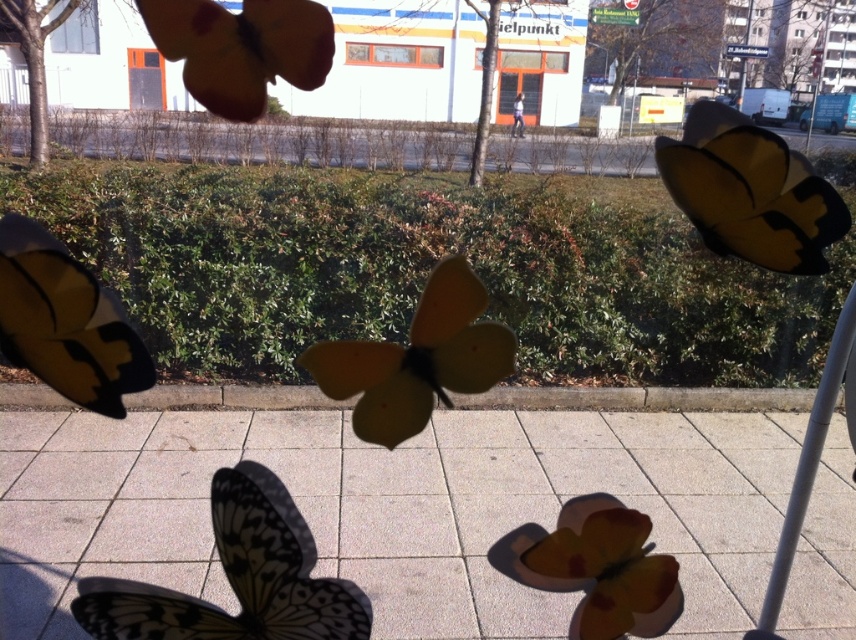
Question: Can you confirm if matte yellow butterfly at upper left is bigger than gray metallic pole at right?

Choices:
 (A) yes
 (B) no

Answer: (B)

Question: Which point is closer to the camera?

Choices:
 (A) matte yellow butterfly at upper left
 (B) white lace butterfly at center

Answer: (A)

Question: Based on their relative distances, which object is farther from the yellow matte butterfly at right?

Choices:
 (A) matte yellow butterfly at center
 (B) gray metallic pole at right
 (C) matte yellow butterfly at upper left
 (D) white lace butterfly at center

Answer: (D)

Question: Among these points, which one is farthest from the camera?

Choices:
 (A) (461, 266)
 (B) (655, 150)
 (C) (107, 593)

Answer: (B)

Question: Can you confirm if white lace butterfly at center is positioned above matte yellow butterfly at left?

Choices:
 (A) no
 (B) yes

Answer: (A)

Question: Does yellow matte butterfly at right lie behind gray metallic pole at right?

Choices:
 (A) yes
 (B) no

Answer: (B)